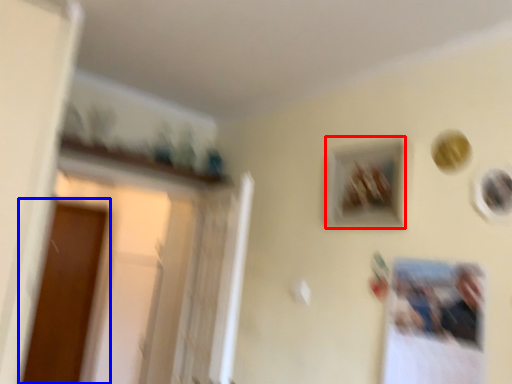
Question: Among these objects, which one is nearest to the camera, picture frame (highlighted by a red box) or screen door (highlighted by a blue box)?

Choices:
 (A) picture frame
 (B) screen door

Answer: (A)